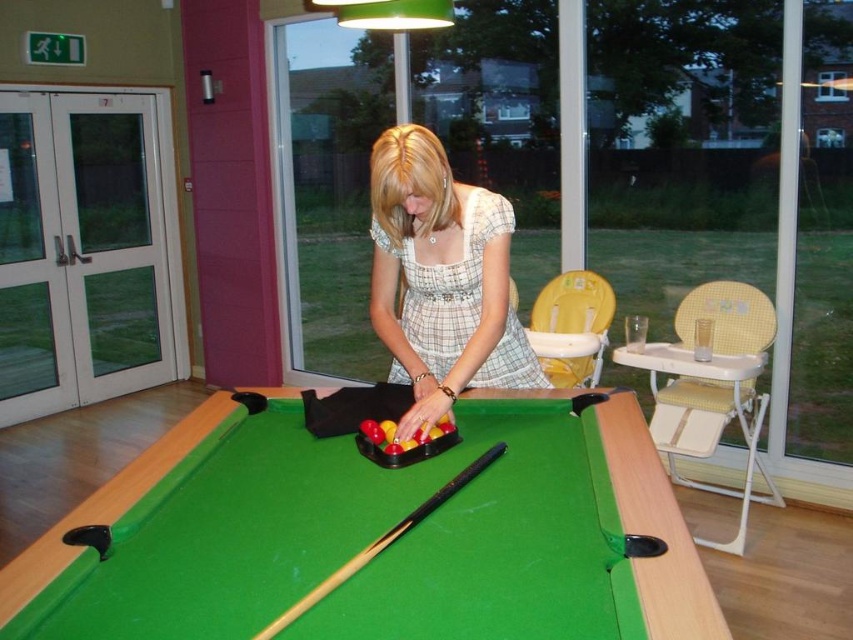
What do you see at coordinates (440, 278) in the screenshot? I see `white checkered dress at center` at bounding box center [440, 278].

I want to click on white checkered dress at center, so click(440, 278).

Does point (216, 625) lie behind point (403, 365)?

No, it is not.

Based on the photo, can you confirm if green felt billiard table at center is positioned to the left of white checkered dress at center?

Correct, you'll find green felt billiard table at center to the left of white checkered dress at center.

Does point (50, 605) lie in front of point (434, 348)?

Yes, it is.

I want to click on green felt billiard table at center, so click(374, 536).

Does green felt billiard table at center appear under wooden smooth cue at center?

No.

Consider the image. Who is higher up, green felt billiard table at center or wooden smooth cue at center?

Positioned higher is green felt billiard table at center.

The width and height of the screenshot is (853, 640). What do you see at coordinates (374, 536) in the screenshot? I see `green felt billiard table at center` at bounding box center [374, 536].

Image resolution: width=853 pixels, height=640 pixels. In order to click on green felt billiard table at center in this screenshot , I will do `click(374, 536)`.